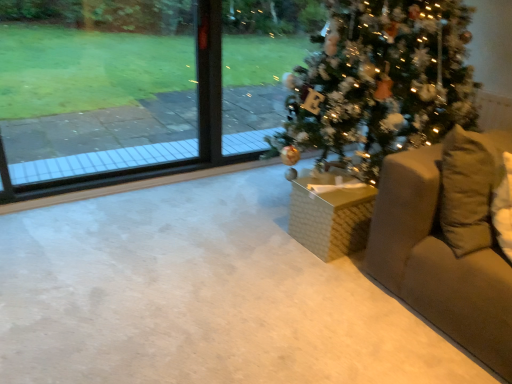
Where is `vacant area that is in front of white woven basket at center, the 2th furniture from the right`? The height and width of the screenshot is (384, 512). vacant area that is in front of white woven basket at center, the 2th furniture from the right is located at coordinates (329, 274).